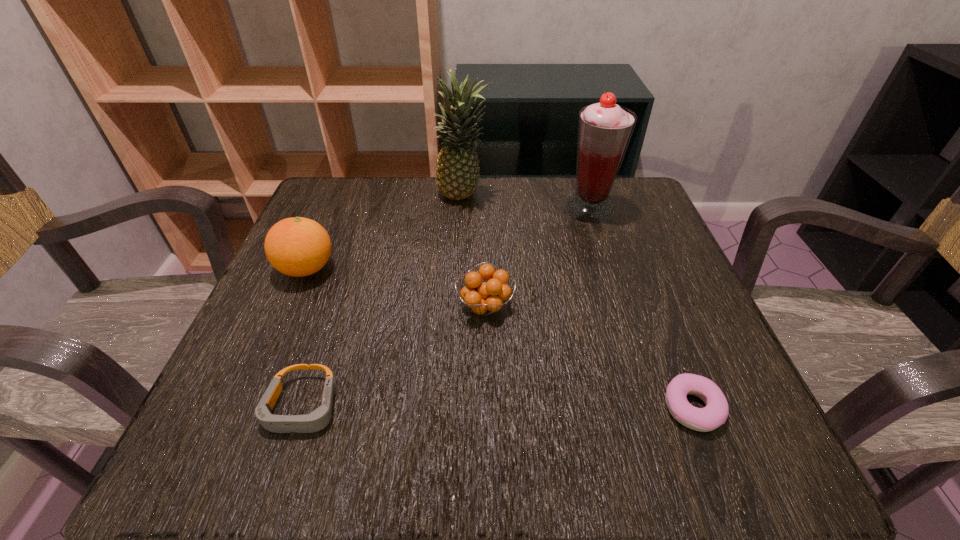
Where is `vacant space located on the right of the taller orange fruit`? Image resolution: width=960 pixels, height=540 pixels. vacant space located on the right of the taller orange fruit is located at coordinates (376, 269).

The image size is (960, 540). I want to click on free location located 0.050m on the front of the fourth tallest object, so click(486, 353).

Identify the location of vacant point located on the left of the pastry. This screenshot has width=960, height=540. (427, 408).

The width and height of the screenshot is (960, 540). I want to click on pineapple situated at the far edge, so click(457, 167).

What are the coordinates of `smoothie positioned at the far edge` in the screenshot? It's located at (604, 129).

Image resolution: width=960 pixels, height=540 pixels. I want to click on goggles located at the near edge, so click(x=317, y=420).

What are the coordinates of `pastry present at the near edge` in the screenshot? It's located at (715, 413).

Where is `orange that is at the left edge`? The width and height of the screenshot is (960, 540). orange that is at the left edge is located at coordinates (297, 247).

Locate an element on the screen. This screenshot has height=540, width=960. goggles that is at the left edge is located at coordinates (317, 420).

Identify the location of smoothie situated at the right edge. (604, 129).